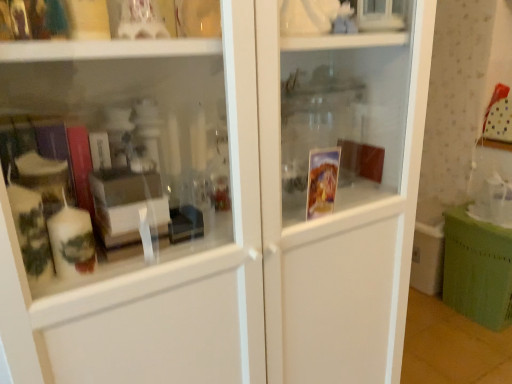
In order to face green woven basket at lower right, should I rotate leftwards or rightwards?

You should rotate right by 28.694 degrees.

The width and height of the screenshot is (512, 384). Describe the element at coordinates (477, 269) in the screenshot. I see `green woven basket at lower right` at that location.

Locate an element on the screen. This screenshot has height=384, width=512. green woven basket at lower right is located at coordinates (477, 269).

This screenshot has height=384, width=512. What are the coordinates of `green woven basket at lower right` in the screenshot? It's located at (477, 269).